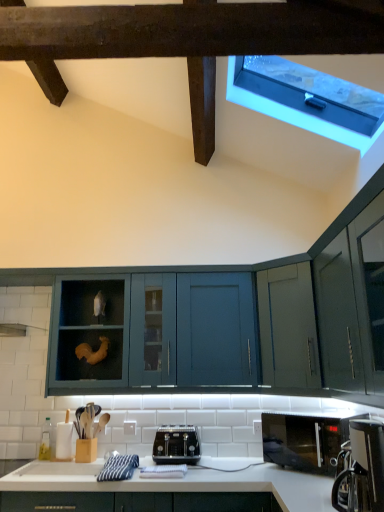
Question: Can we say black matte microwave at lower right lies outside transparent plastic window at upper right?

Choices:
 (A) yes
 (B) no

Answer: (A)

Question: Would you consider black matte microwave at lower right to be distant from transparent plastic window at upper right?

Choices:
 (A) no
 (B) yes

Answer: (B)

Question: Would you say transparent plastic window at upper right is part of black matte microwave at lower right's contents?

Choices:
 (A) yes
 (B) no

Answer: (B)

Question: Can you confirm if black matte microwave at lower right is thinner than transparent plastic window at upper right?

Choices:
 (A) no
 (B) yes

Answer: (B)

Question: Can you confirm if black matte microwave at lower right is smaller than transparent plastic window at upper right?

Choices:
 (A) yes
 (B) no

Answer: (A)

Question: From the image's perspective, relative to white glossy countertop at lower center, is black matte microwave at lower right above or below?

Choices:
 (A) above
 (B) below

Answer: (A)

Question: Would you say black matte microwave at lower right is to the left or to the right of white glossy countertop at lower center in the picture?

Choices:
 (A) left
 (B) right

Answer: (B)

Question: Considering the positions of black matte microwave at lower right and white glossy countertop at lower center in the image, is black matte microwave at lower right wider or thinner than white glossy countertop at lower center?

Choices:
 (A) wide
 (B) thin

Answer: (B)

Question: From their relative heights in the image, would you say black matte microwave at lower right is taller or shorter than white glossy countertop at lower center?

Choices:
 (A) tall
 (B) short

Answer: (B)

Question: Based on their positions, is teal matte cabinet at center located to the left or right of black metallic toaster at center?

Choices:
 (A) right
 (B) left

Answer: (B)

Question: Is teal matte cabinet at center in front of or behind black metallic toaster at center in the image?

Choices:
 (A) behind
 (B) front

Answer: (A)

Question: Is point (228, 329) closer or farther from the camera than point (170, 442)?

Choices:
 (A) closer
 (B) farther

Answer: (B)

Question: Is teal matte cabinet at center taller or shorter than black metallic toaster at center?

Choices:
 (A) short
 (B) tall

Answer: (B)

Question: Is transparent plastic window at upper right bigger or smaller than black metallic toaster at center?

Choices:
 (A) big
 (B) small

Answer: (A)

Question: Is transparent plastic window at upper right taller or shorter than black metallic toaster at center?

Choices:
 (A) short
 (B) tall

Answer: (B)